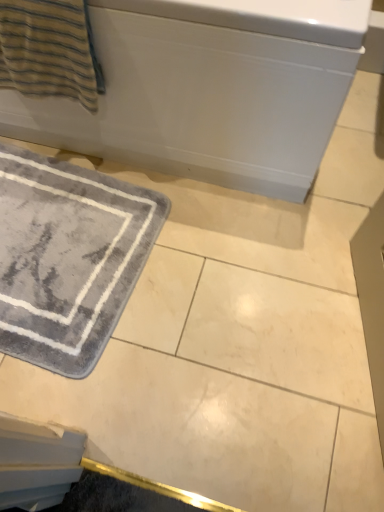
Find the location of `striped cotton towel at upper left`. striped cotton towel at upper left is located at coordinates (49, 50).

Measure the distance between point (48, 201) and camera.

The depth of point (48, 201) is 1.30 meters.

Locate an element on the screen. This screenshot has width=384, height=512. gray plush bath mat at lower left is located at coordinates (68, 258).

This screenshot has height=512, width=384. In order to click on striped cotton towel at upper left in this screenshot , I will do `click(49, 50)`.

Is white glossy bathtub at upper center in front of or behind striped cotton towel at upper left in the image?

In the image, white glossy bathtub at upper center appears in front of striped cotton towel at upper left.

Would you consider white glossy bathtub at upper center to be distant from striped cotton towel at upper left?

No, there isn't a large distance between white glossy bathtub at upper center and striped cotton towel at upper left.

Is white glossy bathtub at upper center positioned with its back to striped cotton towel at upper left?

white glossy bathtub at upper center does not have its back to striped cotton towel at upper left.

From the image's perspective, between white glossy bathtub at upper center and striped cotton towel at upper left, who is located below?

From the image's view, striped cotton towel at upper left is below.

Is point (26, 323) closer or farther from the camera than point (248, 149)?

Point (26, 323) is positioned farther from the camera compared to point (248, 149).

What's the angular difference between gray plush bath mat at lower left and white glossy bathtub at upper center's facing directions?

88.6 degrees.

Does gray plush bath mat at lower left have a lesser width compared to white glossy bathtub at upper center?

Yes, gray plush bath mat at lower left is thinner than white glossy bathtub at upper center.

Between gray plush bath mat at lower left and white glossy bathtub at upper center, which one is positioned in front?

white glossy bathtub at upper center is in front.

Considering their positions, is striped cotton towel at upper left located in front of or behind gray plush bath mat at lower left?

Visually, striped cotton towel at upper left is located in front of gray plush bath mat at lower left.

The height and width of the screenshot is (512, 384). Identify the location of bath mat located behind the striped cotton towel at upper left. (68, 258).

From the image's perspective, who appears lower, striped cotton towel at upper left or gray plush bath mat at lower left?

gray plush bath mat at lower left is shown below in the image.

From the picture: From a real-world perspective, is striped cotton towel at upper left physically below white glossy bathtub at upper center?

No, from a real-world perspective, striped cotton towel at upper left is not below white glossy bathtub at upper center.

Who is shorter, striped cotton towel at upper left or white glossy bathtub at upper center?

striped cotton towel at upper left is shorter.

Is striped cotton towel at upper left facing away from white glossy bathtub at upper center?

Yes, white glossy bathtub at upper center is at the back of striped cotton towel at upper left.

Can you tell me how much striped cotton towel at upper left and white glossy bathtub at upper center differ in facing direction?

striped cotton towel at upper left and white glossy bathtub at upper center are facing 0.769 degrees away from each other.

Is white glossy bathtub at upper center at the left side of gray plush bath mat at lower left?

No.

Considering the positions of point (153, 37) and point (104, 267), is point (153, 37) closer or farther from the camera than point (104, 267)?

Clearly, point (153, 37) is closer to the camera than point (104, 267).

Which of these two, white glossy bathtub at upper center or gray plush bath mat at lower left, stands taller?

white glossy bathtub at upper center is taller.

Between gray plush bath mat at lower left and striped cotton towel at upper left, which one is positioned behind?

gray plush bath mat at lower left is more distant.

Between gray plush bath mat at lower left and striped cotton towel at upper left, which one has larger width?

Wider between the two is gray plush bath mat at lower left.

Can you confirm if gray plush bath mat at lower left is taller than striped cotton towel at upper left?

No.

Does gray plush bath mat at lower left touch striped cotton towel at upper left?

No, gray plush bath mat at lower left is not in contact with striped cotton towel at upper left.

The width and height of the screenshot is (384, 512). What are the coordinates of `beach towel above the white glossy bathtub at upper center (from a real-world perspective)` in the screenshot? It's located at (49, 50).

The height and width of the screenshot is (512, 384). I want to click on bath mat directly beneath the white glossy bathtub at upper center (from a real-world perspective), so click(x=68, y=258).

Estimate the real-world distances between objects in this image. Which object is further from striped cotton towel at upper left, gray plush bath mat at lower left or white glossy bathtub at upper center?

gray plush bath mat at lower left lies further to striped cotton towel at upper left than the other object.

In the scene shown: When comparing their distances from striped cotton towel at upper left, does white glossy bathtub at upper center or gray plush bath mat at lower left seem closer?

white glossy bathtub at upper center is positioned closer to the anchor striped cotton towel at upper left.

Looking at this image, when comparing their distances from white glossy bathtub at upper center, does striped cotton towel at upper left or gray plush bath mat at lower left seem further?

gray plush bath mat at lower left is positioned further to the anchor white glossy bathtub at upper center.

When comparing their distances from gray plush bath mat at lower left, does white glossy bathtub at upper center or striped cotton towel at upper left seem further?

striped cotton towel at upper left.

Which object lies further to the anchor point gray plush bath mat at lower left, striped cotton towel at upper left or white glossy bathtub at upper center?

striped cotton towel at upper left is further to gray plush bath mat at lower left.

Considering their positions, is gray plush bath mat at lower left positioned further to white glossy bathtub at upper center than striped cotton towel at upper left?

gray plush bath mat at lower left is further to white glossy bathtub at upper center.

Identify the location of beach towel between white glossy bathtub at upper center and gray plush bath mat at lower left vertically. (49, 50).